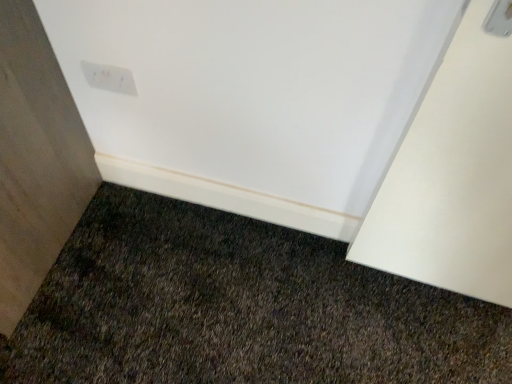
Question: Should I look upward or downward to see white plastic light switch at upper center?

Choices:
 (A) down
 (B) up

Answer: (B)